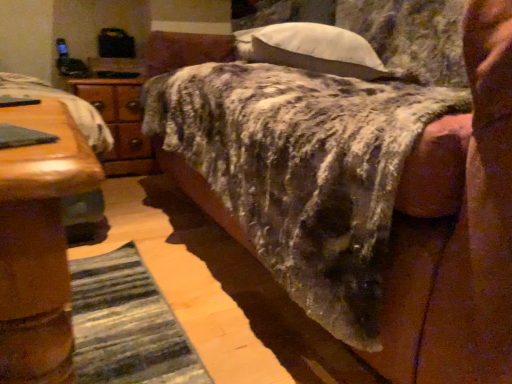
Question: Is textured wool blanket at center completely or partially inside white soft pillow at upper center?

Choices:
 (A) no
 (B) yes

Answer: (A)

Question: Can you confirm if white soft pillow at upper center is bigger than textured wool blanket at center?

Choices:
 (A) no
 (B) yes

Answer: (A)

Question: Can you confirm if white soft pillow at upper center is wider than textured wool blanket at center?

Choices:
 (A) no
 (B) yes

Answer: (A)

Question: From a real-world perspective, is white soft pillow at upper center on textured wool blanket at center?

Choices:
 (A) no
 (B) yes

Answer: (B)

Question: Is white soft pillow at upper center positioned beyond the bounds of textured wool blanket at center?

Choices:
 (A) no
 (B) yes

Answer: (A)

Question: Can you confirm if white soft pillow at upper center is smaller than textured wool blanket at center?

Choices:
 (A) no
 (B) yes

Answer: (B)

Question: From a real-world perspective, is wooden nightstand at left positioned under textured wool blanket at center based on gravity?

Choices:
 (A) yes
 (B) no

Answer: (A)

Question: Can you confirm if wooden nightstand at left is shorter than textured wool blanket at center?

Choices:
 (A) yes
 (B) no

Answer: (A)

Question: Is textured wool blanket at center inside wooden nightstand at left?

Choices:
 (A) no
 (B) yes

Answer: (A)

Question: Is wooden nightstand at left in front of textured wool blanket at center?

Choices:
 (A) no
 (B) yes

Answer: (A)

Question: Is wooden nightstand at left looking in the opposite direction of textured wool blanket at center?

Choices:
 (A) no
 (B) yes

Answer: (A)

Question: Is the position of wooden nightstand at left more distant than that of textured wool blanket at center?

Choices:
 (A) no
 (B) yes

Answer: (B)

Question: From a real-world perspective, is textured wool blanket at center under white soft pillow at upper center?

Choices:
 (A) yes
 (B) no

Answer: (A)